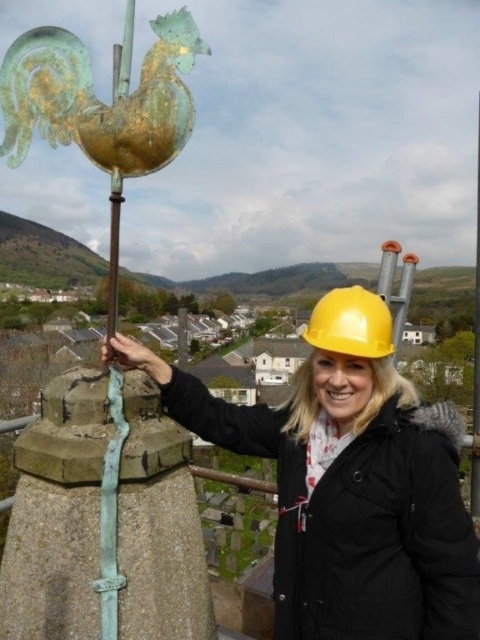
Does yellow hard hat at upper center have a greater height compared to yellow matte hard hat at center?

Indeed, yellow hard hat at upper center has a greater height compared to yellow matte hard hat at center.

Which is behind, point (424, 557) or point (381, 340)?

Positioned behind is point (381, 340).

Where is `yellow hard hat at upper center`? The image size is (480, 640). yellow hard hat at upper center is located at coordinates (349, 483).

How much distance is there between yellow hard hat at upper center and green patina rooster at upper left?

yellow hard hat at upper center is 56.86 meters from green patina rooster at upper left.

Measure the distance between yellow hard hat at upper center and camera.

A distance of 6.55 meters exists between yellow hard hat at upper center and camera.

This screenshot has width=480, height=640. What do you see at coordinates (349, 483) in the screenshot? I see `yellow hard hat at upper center` at bounding box center [349, 483].

Locate an element on the screen. yellow hard hat at upper center is located at coordinates (349, 483).

How far apart are green patina rooster at upper left and yellow matte hard hat at center?

green patina rooster at upper left is 349.61 feet away from yellow matte hard hat at center.

Based on the photo, between green patina rooster at upper left and yellow matte hard hat at center, which one appears on the right side from the viewer's perspective?

From the viewer's perspective, yellow matte hard hat at center appears more on the right side.

Is point (120, 157) positioned after point (323, 321)?

No, it is not.

Locate an element on the screen. The image size is (480, 640). green patina rooster at upper left is located at coordinates (101, 106).